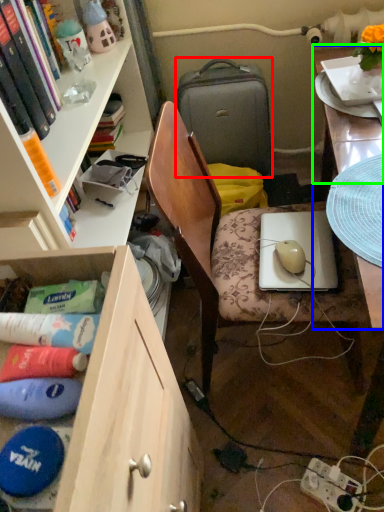
Question: Based on their relative distances, which object is farther from suitcase (highlighted by a red box)? Choose from desk (highlighted by a blue box) and table top (highlighted by a green box).

Choices:
 (A) desk
 (B) table top

Answer: (A)